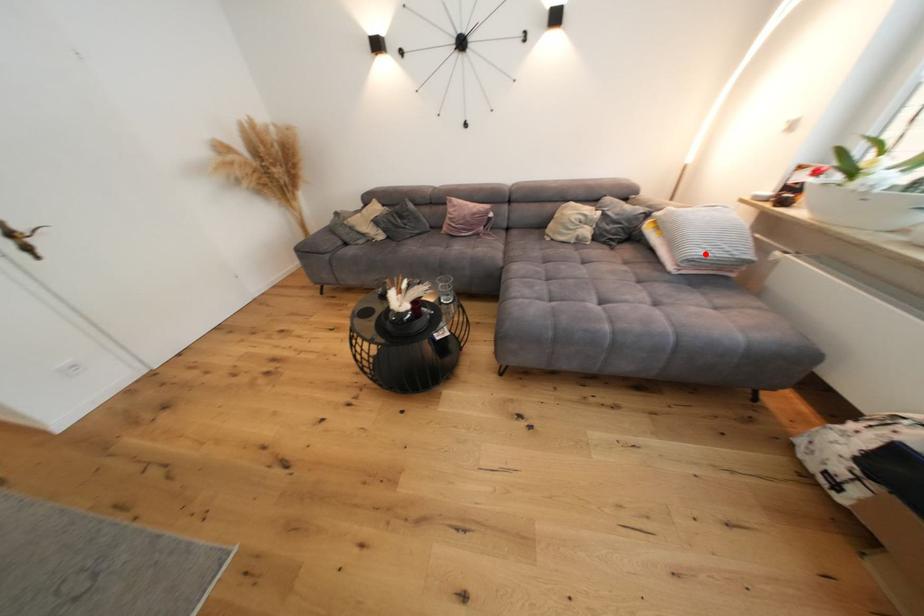
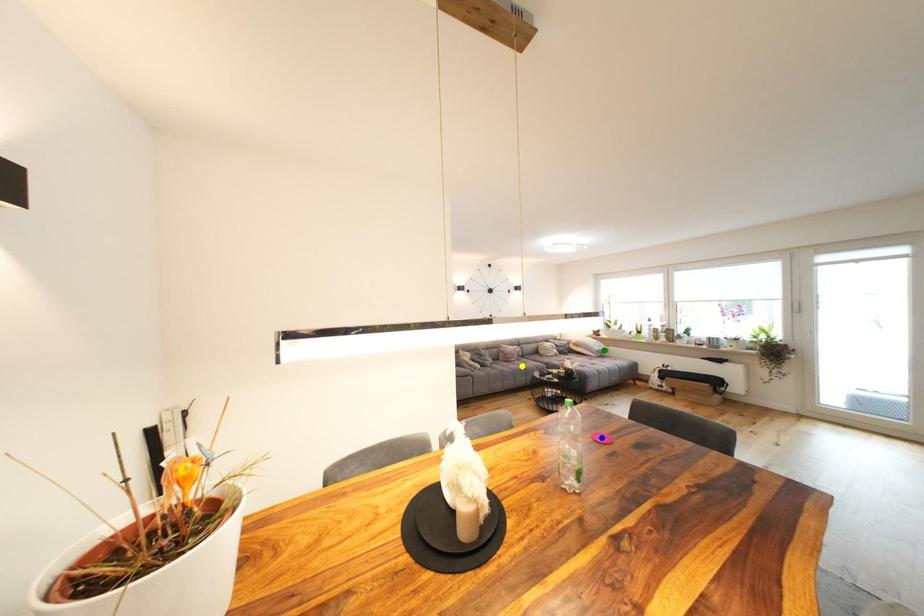
Question: I am providing you with two images of the same scene from different viewpoints. A red point is marked on the first image. You are given multiple points on the second image. Can you choose the point in image 2 that corresponds to the point in image 1?

Choices:
 (A) blue point
 (B) green point
 (C) yellow point

Answer: (B)